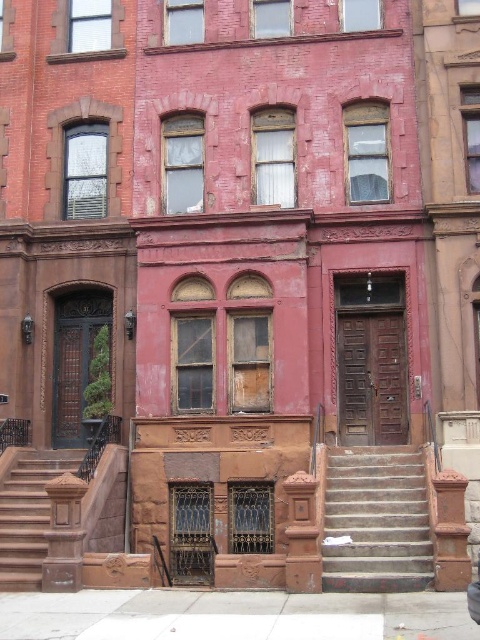
From the picture: Is concrete stairs at center bigger than brown stone stairs at lower left?

Indeed, concrete stairs at center has a larger size compared to brown stone stairs at lower left.

Can you confirm if concrete stairs at center is positioned above brown stone stairs at lower left?

Yes, concrete stairs at center is above brown stone stairs at lower left.

Find the location of a particular element. concrete stairs at center is located at coordinates (375, 520).